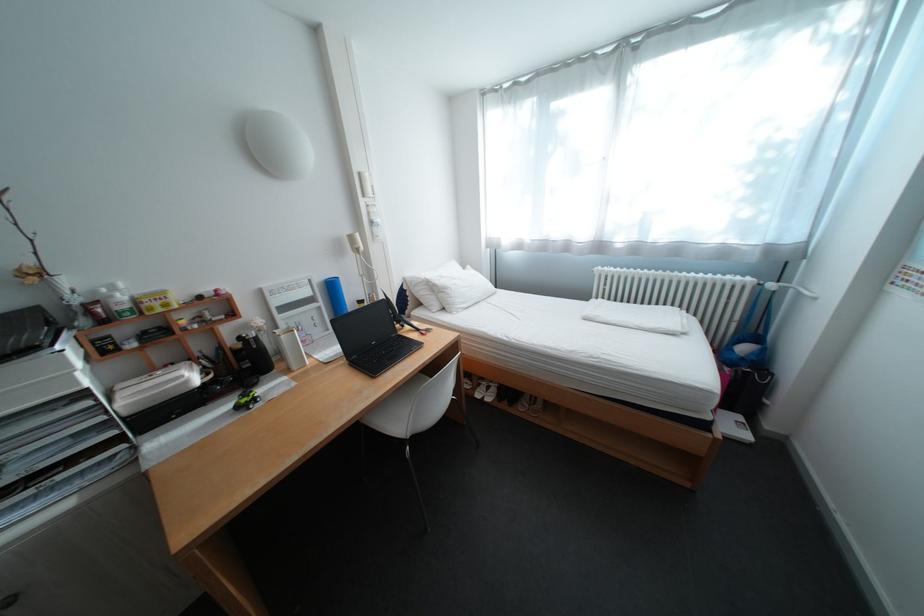
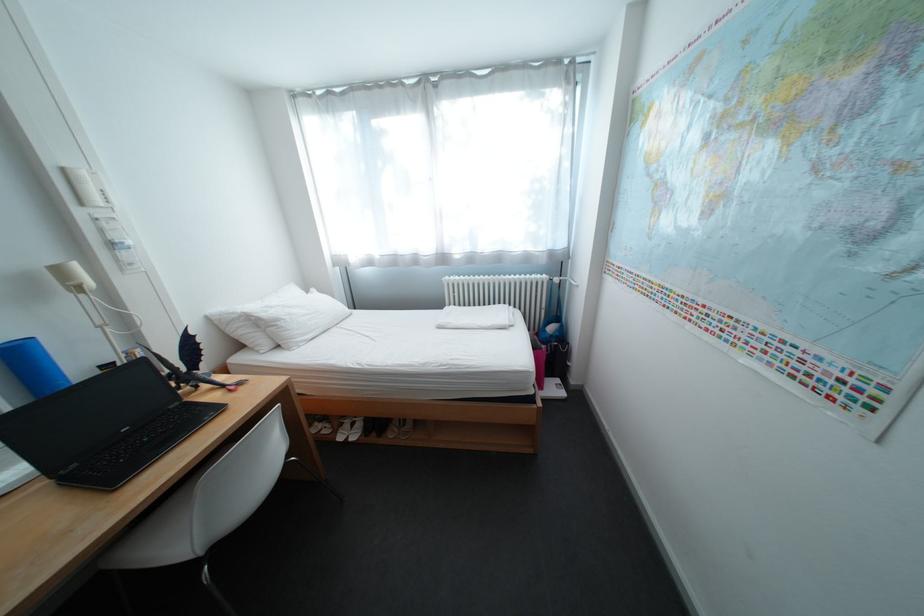
In the second image, find the point that corresponds to pixel 612 268 in the first image.

(459, 278)